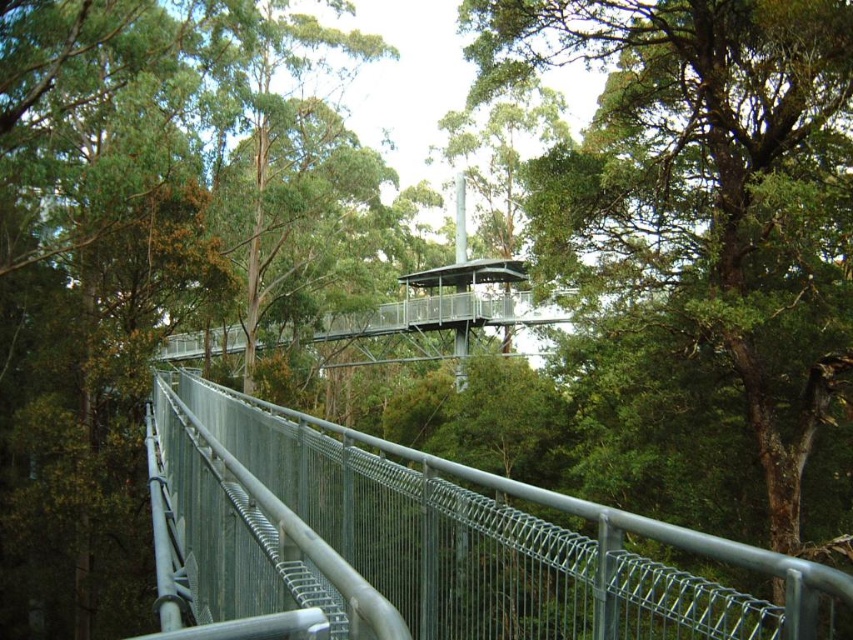
Question: Can you confirm if green leafy tree at center is positioned to the right of metal wire mesh fence at center?

Choices:
 (A) yes
 (B) no

Answer: (A)

Question: Which point is farther to the camera?

Choices:
 (A) (668, 236)
 (B) (305, 417)

Answer: (A)

Question: Observing the image, what is the correct spatial positioning of green leafy tree at center in reference to metal wire mesh fence at center?

Choices:
 (A) right
 (B) left

Answer: (A)

Question: Does green leafy tree at center appear over metal wire mesh fence at center?

Choices:
 (A) no
 (B) yes

Answer: (B)